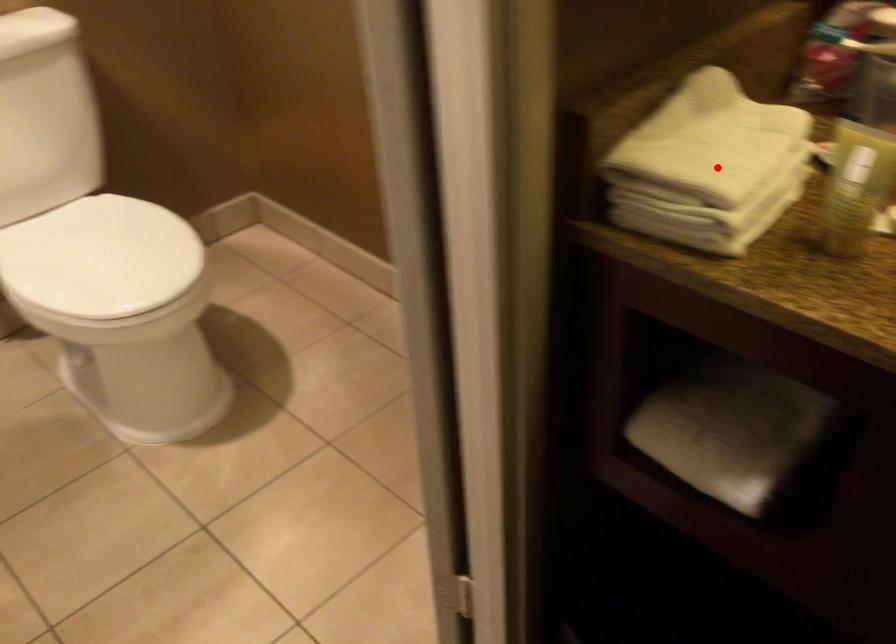
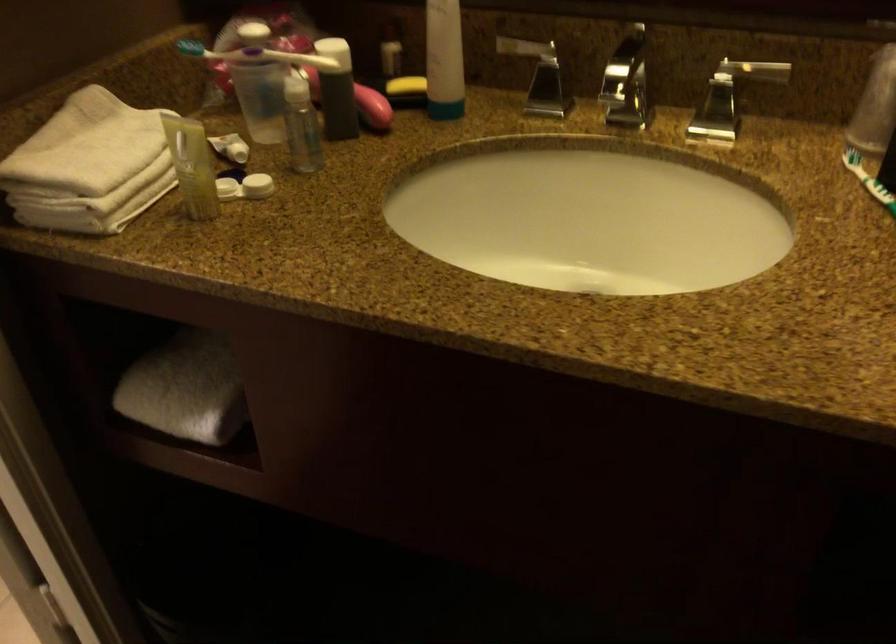
Question: I am providing you with two images of the same scene from different viewpoints. Given a red point in image1, look at the same physical point in image2. Is it:

Choices:
 (A) Closer to the viewpoint
 (B) Farther from the viewpoint

Answer: (B)